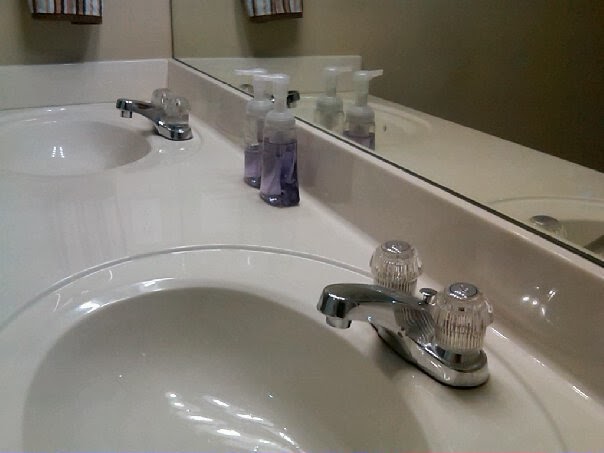
I want to click on cold water knob, so click(x=383, y=266), click(x=162, y=93).